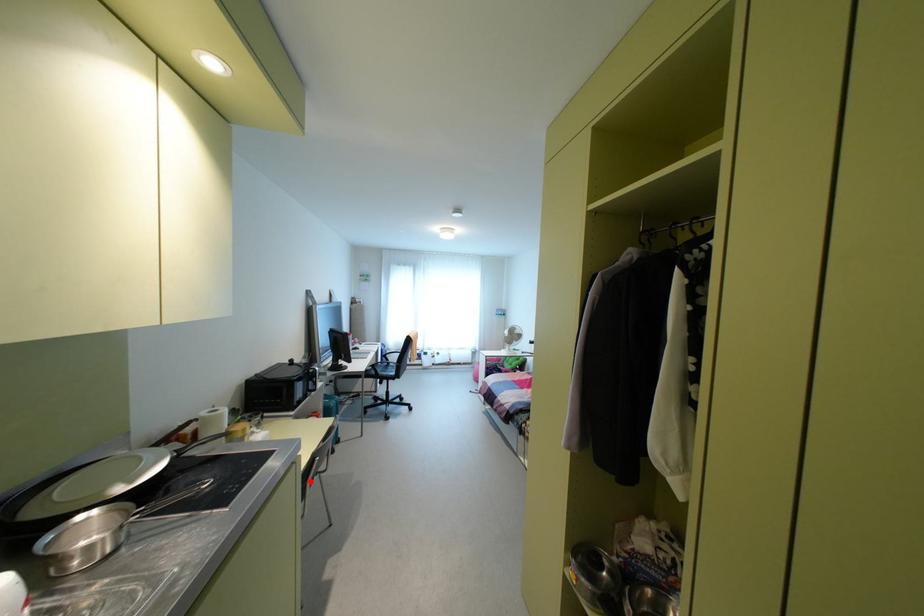
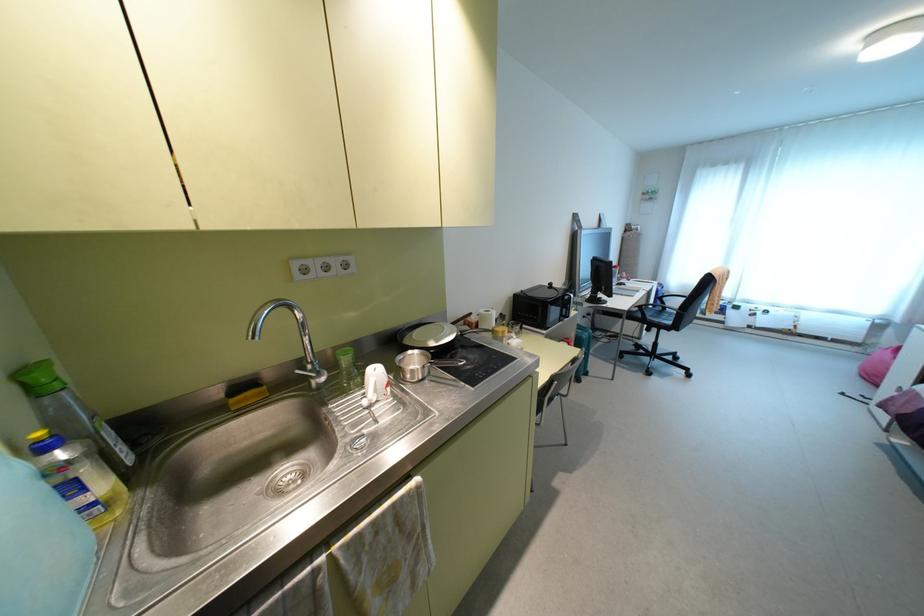
Question: I am providing you with two images of the same scene from different viewpoints. Image1 has a red point marked. In image2, the corresponding 3D location appears at what relative position? Reply with the corresponding letter.

Choices:
 (A) Closer
 (B) Farther

Answer: (B)